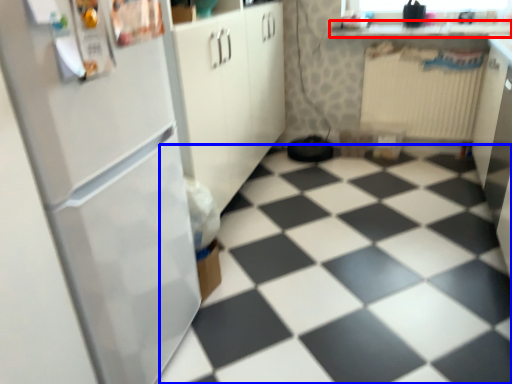
Question: Which of the following is the closest to the observer, counter top (highlighted by a red box) or tile (highlighted by a blue box)?

Choices:
 (A) counter top
 (B) tile

Answer: (B)